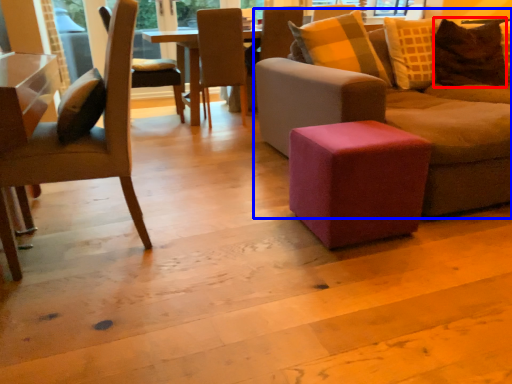
Question: Which of the following is the farthest to the observer, pillow (highlighted by a red box) or studio couch (highlighted by a blue box)?

Choices:
 (A) pillow
 (B) studio couch

Answer: (A)